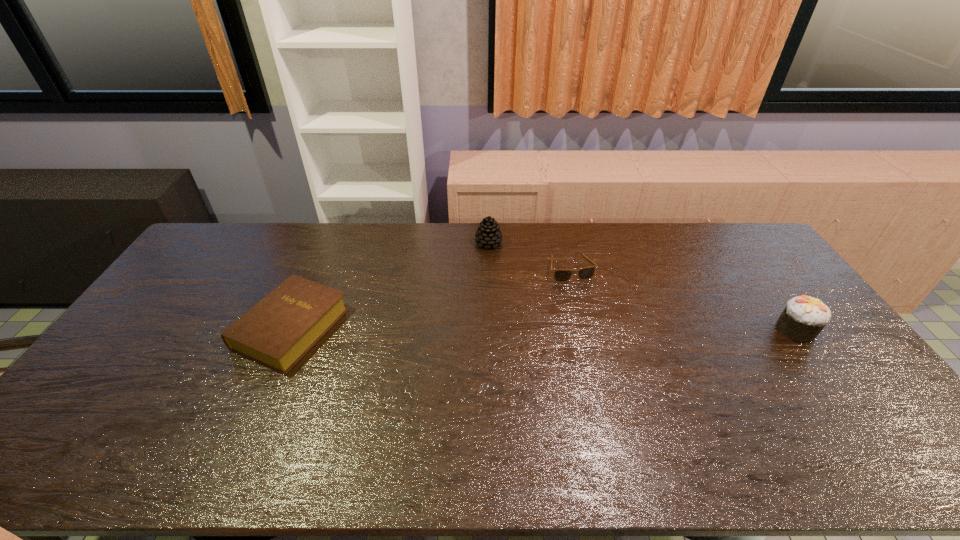
At what (x,y) coordinates should I click in order to perform the action: click on free point between the third object from left to right and the leftmost object. Please return your answer as a coordinate pair (x, y). The height and width of the screenshot is (540, 960). Looking at the image, I should click on (431, 299).

Locate an element on the screen. free space between the shortest object and the farthest object is located at coordinates (530, 256).

Identify the location of unoccupied area between the third nearest object and the leftmost object. The image size is (960, 540). (431, 299).

Identify the location of free space between the sunglasses and the Bible. The image size is (960, 540). (431, 299).

Locate which object ranks in proximity to the farthest object. Please provide its 2D coordinates. Your answer should be formatted as a tuple, i.e. [(x, y)], where the tuple contains the x and y coordinates of a point satisfying the conditions above.

[(560, 275)]

The image size is (960, 540). In order to click on the third closest object to the third object from right to left in this screenshot , I will do `click(804, 317)`.

Image resolution: width=960 pixels, height=540 pixels. Find the location of `vacant space that satisfies the following two spatial constraints: 1. on the front side of the sunglasses; 2. on the right side of the cupcake`. vacant space that satisfies the following two spatial constraints: 1. on the front side of the sunglasses; 2. on the right side of the cupcake is located at coordinates (585, 329).